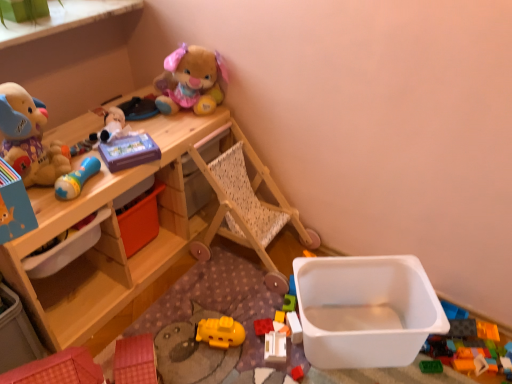
You are a GUI agent. You are given a task and a screenshot of the screen. Output one action in this format:
    pyautogui.click(x=<x>, y=<y>)
    Task: Click on the vacant space underneath fluffy plush rabbit at upper center, the 1th toy viewed from the top (from a real-world perspective)
    
    Given the screenshot: What is the action you would take?
    pyautogui.click(x=184, y=115)